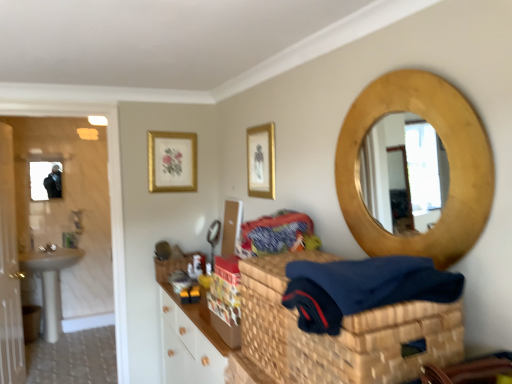
What do you see at coordinates (9, 270) in the screenshot? I see `white glossy door at left` at bounding box center [9, 270].

The image size is (512, 384). Identify the location of patterned fabric at center. (278, 234).

In order to face gold-framed artwork at upper center, the 1th picture frame when ordered from left to right, should I rotate leftwards or rightwards?

Turn left approximately 10.946 degrees to face it.

Image resolution: width=512 pixels, height=384 pixels. Describe the element at coordinates (172, 162) in the screenshot. I see `gold-framed artwork at upper center, the 1th picture frame when ordered from left to right` at that location.

Where is `gold wooden mirror at upper right`? This screenshot has width=512, height=384. gold wooden mirror at upper right is located at coordinates (448, 159).

Identify the location of gold metallic picture frame at upper center, the 1th picture frame when ordered from front to back. (261, 161).

Locate an element on the screen. woven straw basket at center is located at coordinates (340, 332).

Does woven straw basket at center have a lesser width compared to gold metallic picture frame at upper center, acting as the 2th picture frame starting from the left?

No, woven straw basket at center is not thinner than gold metallic picture frame at upper center, acting as the 2th picture frame starting from the left.

Relative to gold metallic picture frame at upper center, acting as the 2th picture frame starting from the left, is woven straw basket at center in front or behind?

Clearly, woven straw basket at center is in front of gold metallic picture frame at upper center, acting as the 2th picture frame starting from the left.

Between woven straw basket at center and gold metallic picture frame at upper center, acting as the 2th picture frame starting from the left, which one appears on the left side from the viewer's perspective?

gold metallic picture frame at upper center, acting as the 2th picture frame starting from the left, is more to the left.

Considering the relative sizes of woven straw basket at center and gold metallic picture frame at upper center, marked as the 2th picture frame in a back-to-front arrangement, in the image provided, is woven straw basket at center bigger than gold metallic picture frame at upper center, marked as the 2th picture frame in a back-to-front arrangement,?

Indeed, woven straw basket at center has a larger size compared to gold metallic picture frame at upper center, marked as the 2th picture frame in a back-to-front arrangement.

Does gold textured mirror at upper right have a lesser height compared to gold wooden mirror at upper right?

Indeed, gold textured mirror at upper right has a lesser height compared to gold wooden mirror at upper right.

Can you confirm if gold textured mirror at upper right is positioned to the right of gold wooden mirror at upper right?

In fact, gold textured mirror at upper right is to the left of gold wooden mirror at upper right.

Is gold textured mirror at upper right closer to the viewer compared to gold wooden mirror at upper right?

No, it is not.

In the scene shown: From the image's perspective, between gold-framed artwork at upper center, the 1th picture frame when ordered from left to right, and patterned fabric at center, who is located below?

patterned fabric at center appears lower in the image.

Is patterned fabric at center inside gold-framed artwork at upper center, the first picture frame in the back-to-front sequence?

Actually, patterned fabric at center is outside gold-framed artwork at upper center, the first picture frame in the back-to-front sequence.

In the scene shown: Which of these two, gold-framed artwork at upper center, the 2th picture frame viewed from the front, or patterned fabric at center, is wider?

patterned fabric at center is wider.

Who is more distant, gold-framed artwork at upper center, the second picture frame positioned from the right, or patterned fabric at center?

gold-framed artwork at upper center, the second picture frame positioned from the right.

Considering the sizes of objects patterned fabric at center and woven straw basket at center in the image provided, who is bigger, patterned fabric at center or woven straw basket at center?

woven straw basket at center is bigger.

Does patterned fabric at center appear on the right side of woven straw basket at center?

In fact, patterned fabric at center is to the left of woven straw basket at center.

Is patterned fabric at center oriented away from woven straw basket at center?

That's not correct — patterned fabric at center is not looking away from woven straw basket at center.

Consider the image. Which is closer, (274, 222) or (399, 382)?

Point (274, 222) appears to be farther away from the viewer than point (399, 382).

Can you confirm if woven straw basket at center is positioned to the right of gold wooden mirror at upper right?

In fact, woven straw basket at center is to the left of gold wooden mirror at upper right.

From a real-world perspective, which object rests below the other?

woven straw basket at center is physically lower.

How much distance is there between woven straw basket at center and gold wooden mirror at upper right?

A distance of 16.97 inches exists between woven straw basket at center and gold wooden mirror at upper right.

Who is bigger, woven straw basket at center or gold wooden mirror at upper right?

woven straw basket at center is bigger.

Can you confirm if woven straw basket at center is smaller than gold textured mirror at upper right?

Actually, woven straw basket at center might be larger than gold textured mirror at upper right.

Is point (282, 278) positioned behind point (31, 169)?

No, it is not.

Is woven straw basket at center aimed at gold textured mirror at upper right?

No, woven straw basket at center is not facing towards gold textured mirror at upper right.

Does woven straw basket at center have a greater width compared to gold textured mirror at upper right?

Correct, the width of woven straw basket at center exceeds that of gold textured mirror at upper right.

Does point (264, 227) lie in front of point (196, 158)?

Yes.

Considering the sizes of patterned fabric at center and gold-framed artwork at upper center, the second picture frame positioned from the right, in the image, is patterned fabric at center wider or thinner than gold-framed artwork at upper center, the second picture frame positioned from the right,?

Clearly, patterned fabric at center has more width compared to gold-framed artwork at upper center, the second picture frame positioned from the right.

Considering the relative positions of patterned fabric at center and gold-framed artwork at upper center, the 1th picture frame when ordered from left to right, in the image provided, is patterned fabric at center in front of gold-framed artwork at upper center, the 1th picture frame when ordered from left to right,?

Yes.

From the image's perspective, is patterned fabric at center above or below gold-framed artwork at upper center, the second picture frame positioned from the right?

Based on their image positions, patterned fabric at center is located beneath gold-framed artwork at upper center, the second picture frame positioned from the right.

In order to click on basket in front of the gold metallic picture frame at upper center, acting as the 2th picture frame starting from the left in this screenshot , I will do `click(340, 332)`.

Find the location of a particular element. mirror on the left of the gold wooden mirror at upper right is located at coordinates (40, 178).

Based on their spatial positions, is white glossy door at left or gold textured mirror at upper right further from white glossy sink at left?

gold textured mirror at upper right is further to white glossy sink at left.

Estimate the real-world distances between objects in this image. Which object is further from gold metallic picture frame at upper center, the 1th picture frame in the right-to-left sequence, woven straw basket at center or gold-framed artwork at upper center, the 1th picture frame when ordered from left to right?

The object further to gold metallic picture frame at upper center, the 1th picture frame in the right-to-left sequence, is woven straw basket at center.

Considering their positions, is gold-framed artwork at upper center, the 2th picture frame viewed from the front, positioned further to gold wooden mirror at upper right than gold textured mirror at upper right?

Among the two, gold textured mirror at upper right is located further to gold wooden mirror at upper right.

Estimate the real-world distances between objects in this image. Which object is closer to white glossy door at left, patterned fabric at center or gold textured mirror at upper right?

gold textured mirror at upper right lies closer to white glossy door at left than the other object.

Based on their spatial positions, is gold textured mirror at upper right or white glossy sink at left closer to gold-framed artwork at upper center, the second picture frame positioned from the right?

gold textured mirror at upper right is positioned closer to the anchor gold-framed artwork at upper center, the second picture frame positioned from the right.

Which object lies further to the anchor point gold metallic picture frame at upper center, acting as the 2th picture frame starting from the left, white glossy door at left or patterned fabric at center?

white glossy door at left is further to gold metallic picture frame at upper center, acting as the 2th picture frame starting from the left.

Based on their spatial positions, is gold textured mirror at upper right or woven straw basket at center further from gold-framed artwork at upper center, the first picture frame in the back-to-front sequence?

gold textured mirror at upper right is positioned further to the anchor gold-framed artwork at upper center, the first picture frame in the back-to-front sequence.

When comparing their distances from woven straw basket at center, does gold textured mirror at upper right or patterned fabric at center seem further?

Among the two, gold textured mirror at upper right is located further to woven straw basket at center.

Identify the location of door situated between white glossy sink at left and gold-framed artwork at upper center, the first picture frame in the back-to-front sequence, from left to right. (9, 270).

You are a GUI agent. You are given a task and a screenshot of the screen. Output one action in this format:
    pyautogui.click(x=<x>, y=<y>)
    Task: Click on the door between patterned fabric at center and gold textured mirror at upper right along the z-axis
    The image size is (512, 384).
    Given the screenshot: What is the action you would take?
    pyautogui.click(x=9, y=270)

What are the coordinates of `oval located between woven straw basket at center and gold-framed artwork at upper center, the first picture frame in the back-to-front sequence, in the depth direction` in the screenshot? It's located at click(448, 159).

Locate an element on the screen. The width and height of the screenshot is (512, 384). material located between white glossy door at left and gold wooden mirror at upper right in the left-right direction is located at coordinates (278, 234).